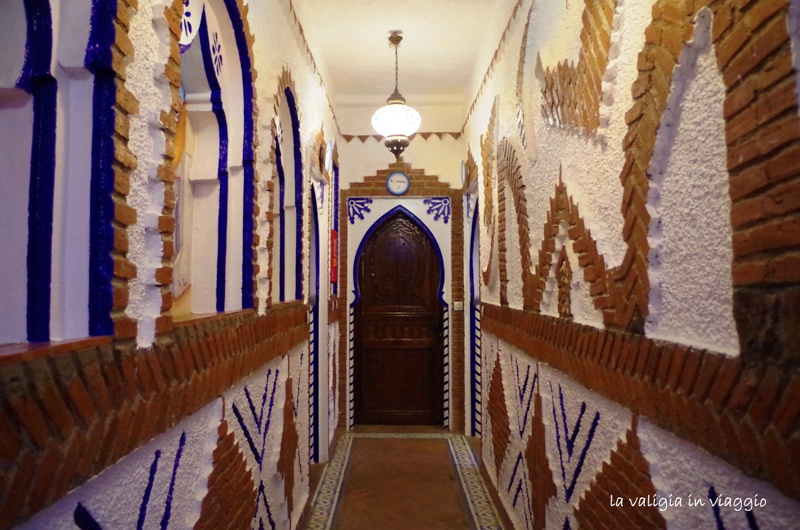
You are a GUI agent. You are given a task and a screenshot of the screen. Output one action in this format:
    pyautogui.click(x=<x>, y=<y>)
    Task: Click on the ceiling
    This screenshot has width=800, height=530.
    Given the screenshot: What is the action you would take?
    pyautogui.click(x=457, y=41), pyautogui.click(x=365, y=30), pyautogui.click(x=433, y=20)